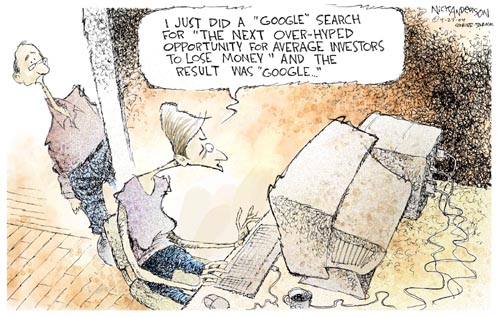
Locate an element on the screen. Image resolution: width=500 pixels, height=317 pixels. cup of coffee is located at coordinates (300, 294).